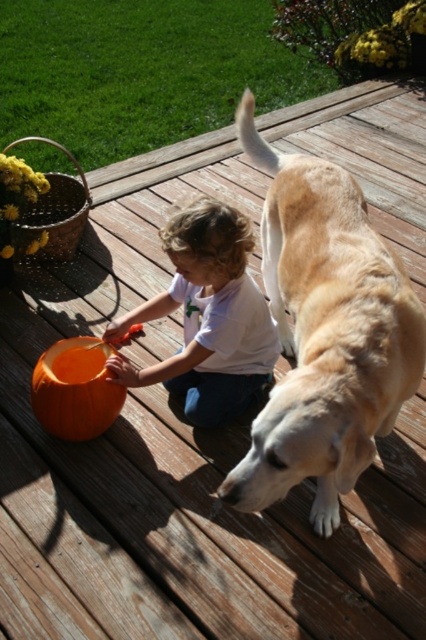
You are a photographer setting up for a family photo. You need to ensure that the golden fur dog at center and the white cotton shirt at center are both in frame. Given their sizes, which object should you adjust your camera angle to focus on first to ensure both fit?

The golden fur dog at center has a lesser width compared to the white cotton shirt at center. Therefore, you should focus on the wider white cotton shirt at center first to ensure it fits in the frame, then adjust to include the smaller dog.

You are a photographer setting up a shot of the white cotton shirt at center and the orange matte pumpkin at center. To ensure both are in focus, you need to know which object is taller. Which one is taller?

The white cotton shirt at center is taller than the orange matte pumpkin at center.

In the scene, you see a white cotton shirt at center and an orange matte pumpkin at center. Which object is located to the right of the other?

The white cotton shirt at center is positioned on the right side of orange matte pumpkin at center.